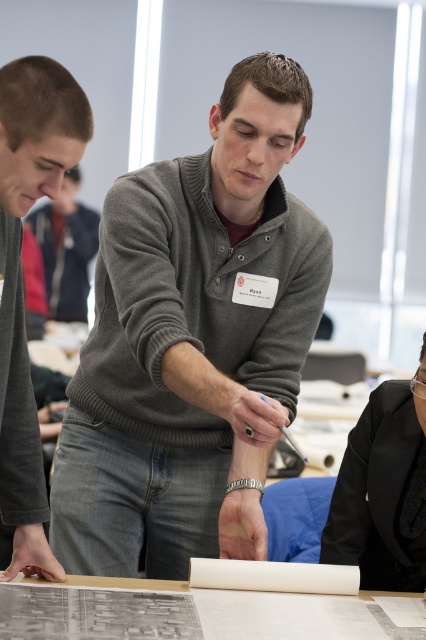
You are a photographer standing in the room and want to take a photo of the brown hair at left and the matte gray sweater at center. Based on their heights, which object should you adjust your camera angle to look up at?

You should adjust your camera angle to look up at the matte gray sweater at center because the brown hair at left has a lesser height compared to matte gray sweater at center.

You are an assistant organizing a presentation. You need to place the black satin blazer at lower right and the matte gray sweater at center on a rack. According to the image, which one should be placed below the other?

The black satin blazer at lower right is positioned under the matte gray sweater at center in the image, so it should be placed below the matte gray sweater at center on the rack.

You are a person who needs to pass a 75 centimeter wide box through the space between the brown hair at left and the black satin blazer at lower right. Can you do it?

The brown hair at left is 75.33 centimeters away from the black satin blazer at lower right, so yes, the box can pass through the space between them since the distance is slightly larger than the box width.